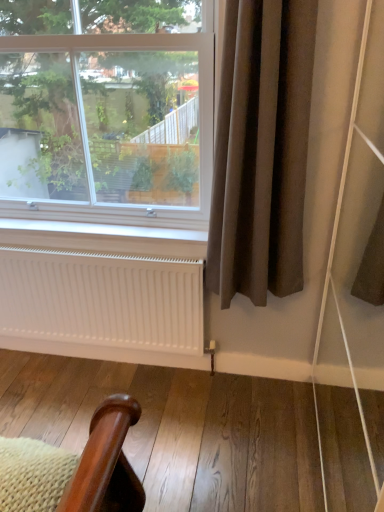
Question: Relative to white matte radiator at lower center, is clear glass window at upper left in front or behind?

Choices:
 (A) front
 (B) behind

Answer: (A)

Question: Looking at the image, does clear glass window at upper left seem bigger or smaller compared to white matte radiator at lower center?

Choices:
 (A) big
 (B) small

Answer: (A)

Question: Which of these objects is positioned farthest from the white matte radiator at lower center?

Choices:
 (A) brown fabric curtain at right
 (B) clear glass window at upper left

Answer: (B)

Question: Which is farther from the brown fabric curtain at right?

Choices:
 (A) white matte radiator at lower center
 (B) clear glass window at upper left

Answer: (B)